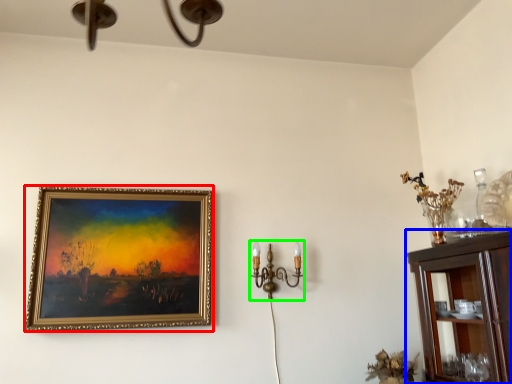
Question: Considering the real-world distances, which object is farthest from picture frame (highlighted by a red box)? cabinetry (highlighted by a blue box) or candle holder (highlighted by a green box)?

Choices:
 (A) cabinetry
 (B) candle holder

Answer: (A)